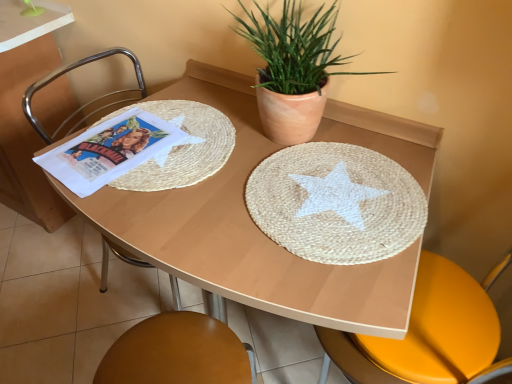
Question: Is point (338, 72) positioned closer to the camera than point (374, 162)?

Choices:
 (A) closer
 (B) farther

Answer: (B)

Question: From a real-world perspective, is terracotta clay pot at upper center above or below natural fiber placemat at center?

Choices:
 (A) above
 (B) below

Answer: (A)

Question: Estimate the real-world distances between objects in this image. Which object is closer to the wooden table at center?

Choices:
 (A) brushed metal chair at left
 (B) white paper comic book at left
 (C) natural fiber placemat at center
 (D) terracotta clay pot at upper center

Answer: (C)

Question: Which object is positioned closest to the white paper comic book at left?

Choices:
 (A) wooden table at center
 (B) terracotta clay pot at upper center
 (C) natural fiber placemat at center
 (D) brushed metal chair at left

Answer: (A)